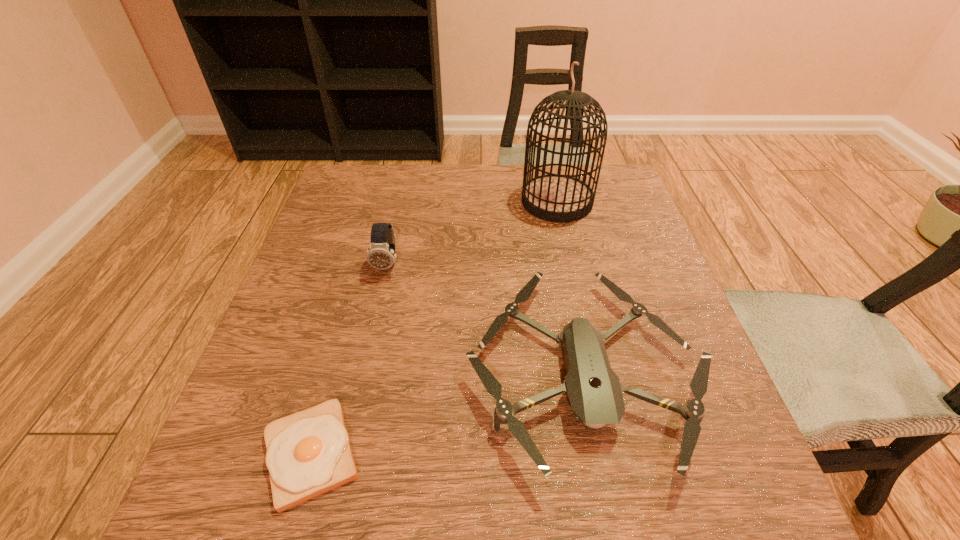
The width and height of the screenshot is (960, 540). I want to click on empty space between the watch and the toast, so click(x=349, y=359).

I want to click on vacant point located between the shortest object and the farthest object, so click(x=434, y=328).

This screenshot has width=960, height=540. In order to click on empty space between the drone and the farthest object in this screenshot , I will do `click(569, 286)`.

The image size is (960, 540). Find the location of `vacant region between the drone and the second farthest object`. vacant region between the drone and the second farthest object is located at coordinates (485, 317).

Identify the location of object that is the closest one to the drone. Image resolution: width=960 pixels, height=540 pixels. 381,255.

Locate which object is the closest to the second shortest object. Please provide its 2D coordinates. Your answer should be formatted as a tuple, i.e. [(x, y)], where the tuple contains the x and y coordinates of a point satisfying the conditions above.

[(381, 255)]